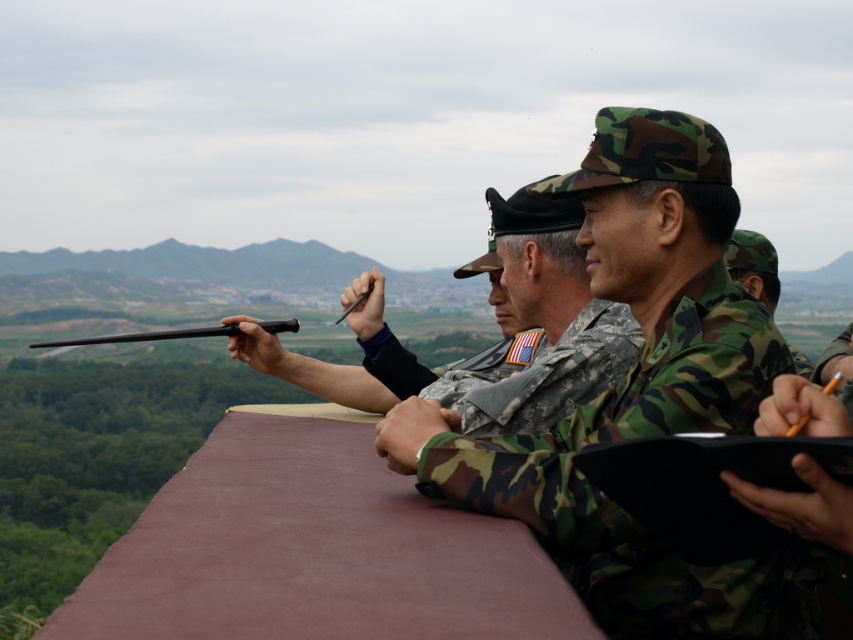
Question: Which object is the farthest from the camo fabric uniform at center?

Choices:
 (A) camo uniform at center
 (B) black matte gun at center

Answer: (B)

Question: Is camo uniform at center wider than black matte gun at center?

Choices:
 (A) no
 (B) yes

Answer: (A)

Question: Which object is closer to the camera taking this photo?

Choices:
 (A) black matte gun at center
 (B) camo fabric uniform at center
 (C) camo uniform at center

Answer: (B)

Question: Does camo fabric uniform at center come behind camo uniform at center?

Choices:
 (A) no
 (B) yes

Answer: (A)

Question: Does camo fabric uniform at center have a greater width compared to black matte gun at center?

Choices:
 (A) no
 (B) yes

Answer: (A)

Question: Which point is closer to the camera?

Choices:
 (A) black matte gun at center
 (B) camo fabric uniform at center
 (C) camo uniform at center

Answer: (B)